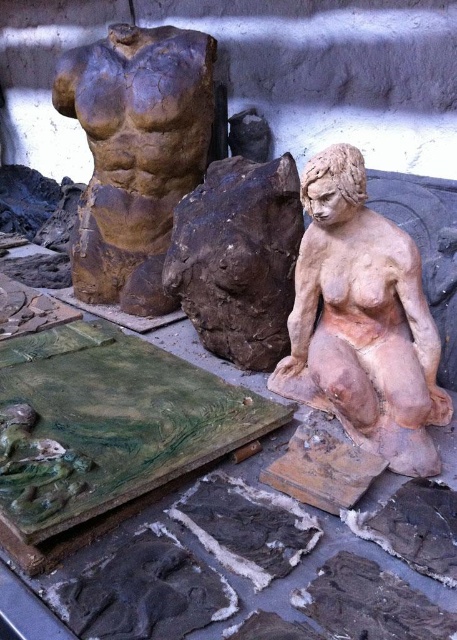
Question: Does matte clay torso at upper center have a larger size compared to brown clay torso at upper left?

Choices:
 (A) no
 (B) yes

Answer: (A)

Question: Considering the relative positions of matte clay torso at upper center and brown clay torso at upper left in the image provided, where is matte clay torso at upper center located with respect to brown clay torso at upper left?

Choices:
 (A) below
 (B) above

Answer: (A)

Question: Where is matte clay torso at upper center located in relation to brown clay torso at upper left in the image?

Choices:
 (A) right
 (B) left

Answer: (A)

Question: Which of the following is the farthest from the observer?

Choices:
 (A) (389, 280)
 (B) (176, 48)

Answer: (B)

Question: Among these objects, which one is nearest to the camera?

Choices:
 (A) brown clay torso at upper left
 (B) matte clay torso at upper center

Answer: (B)